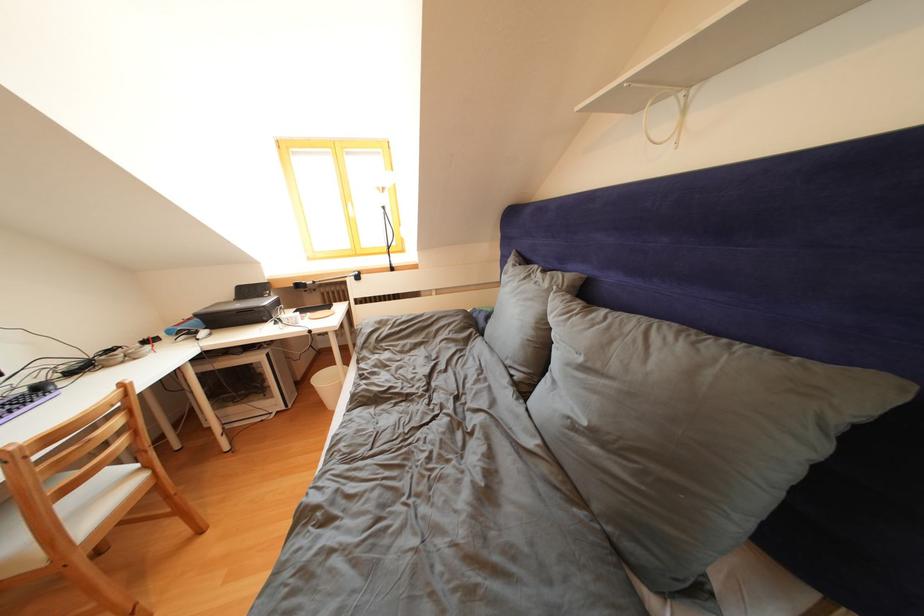
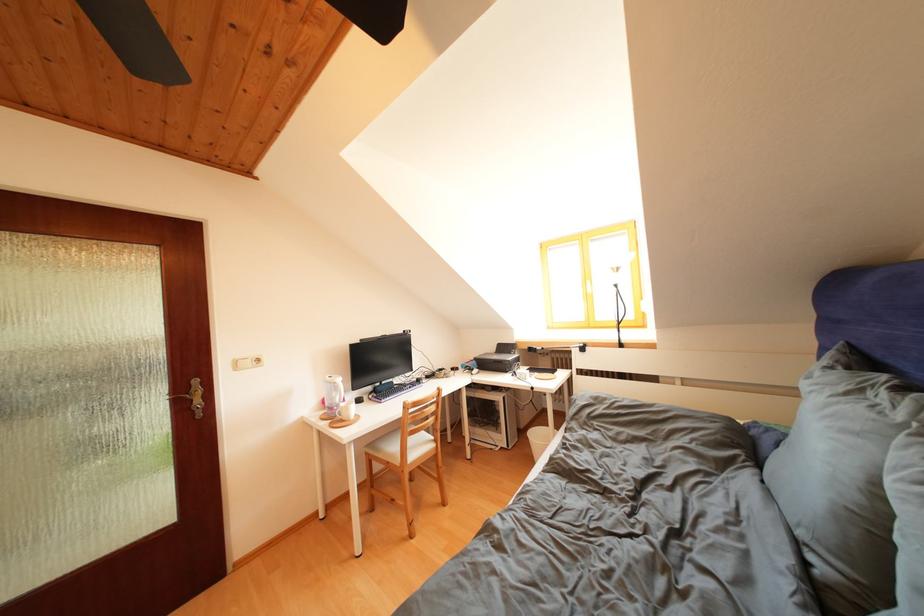
Where in the second image is the point corresponding to point (269, 301) from the first image?

(517, 358)